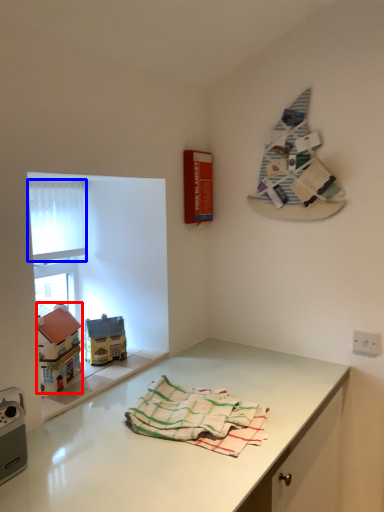
Question: Which of the following is the farthest to the observer, toy (highlighted by a red box) or window screen (highlighted by a blue box)?

Choices:
 (A) toy
 (B) window screen

Answer: (B)